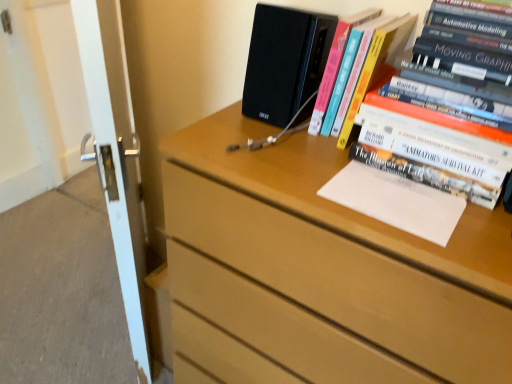
The image size is (512, 384). In order to click on vacant area in front of white paper at upper right in this screenshot , I will do `click(421, 240)`.